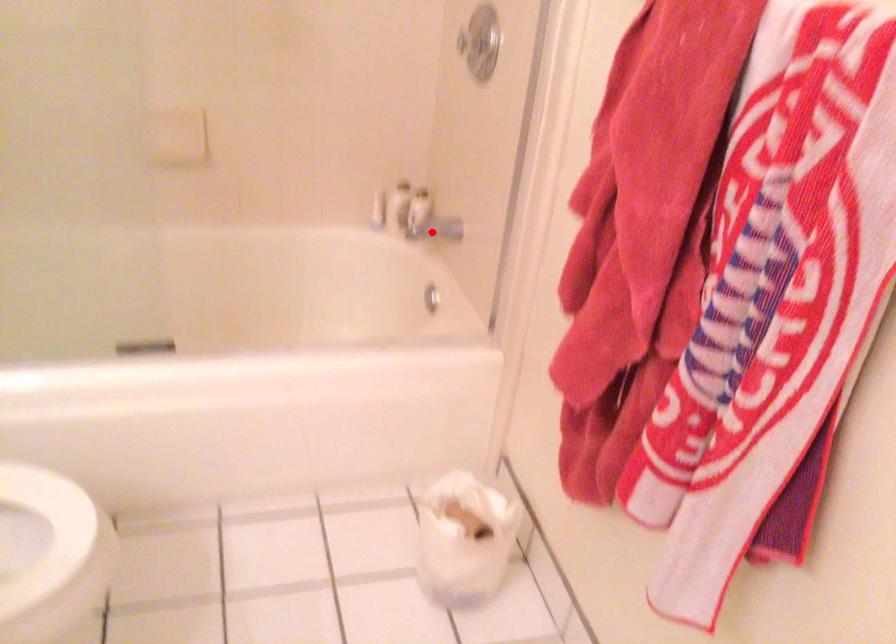
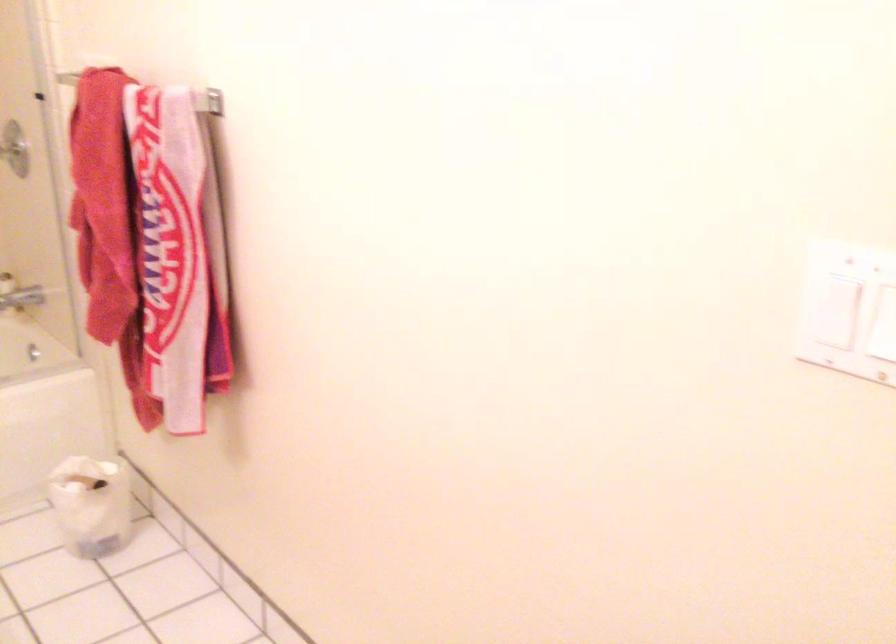
Find the pixel in the second image that matches the highlighted location in the first image.

(20, 299)